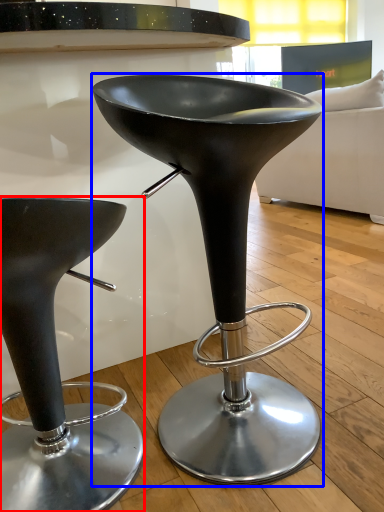
Question: Which point is closer to the camera, stool (highlighted by a red box) or stool (highlighted by a blue box)?

Choices:
 (A) stool
 (B) stool

Answer: (B)